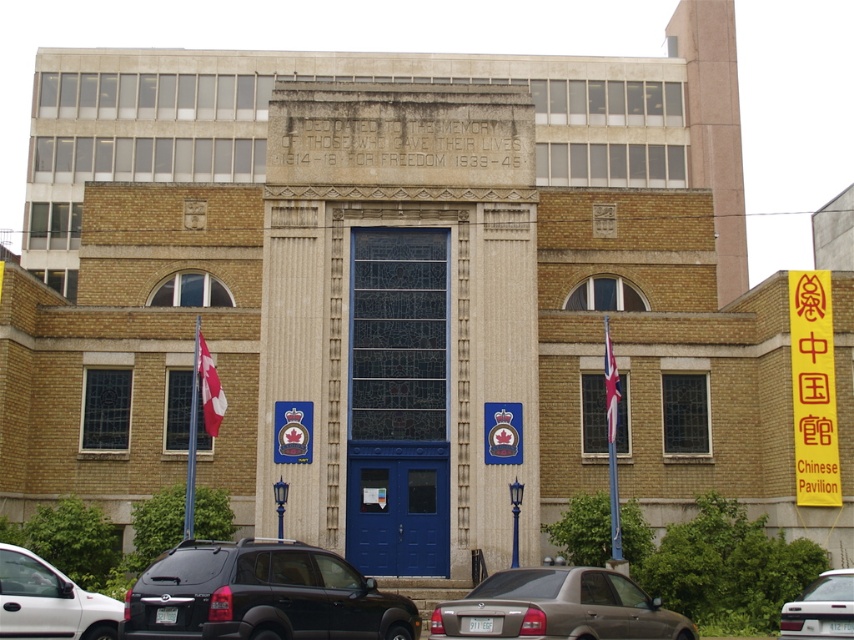
You are a delivery driver approaching the building and need to park your vehicle, which is 5 meters long, between the black matte suv at center and the red fabric flag at center. Is there enough space to park your vehicle between them without touching either?

The black matte suv at center is 18.87 meters away from the red fabric flag at center. Since the distance between them is greater than the vehicle length of 5 meters, there is sufficient space to park between them without touching either.

What are the coordinates of the black matte suv at center?

The coordinates of the black matte suv at center are at point (261, 595).